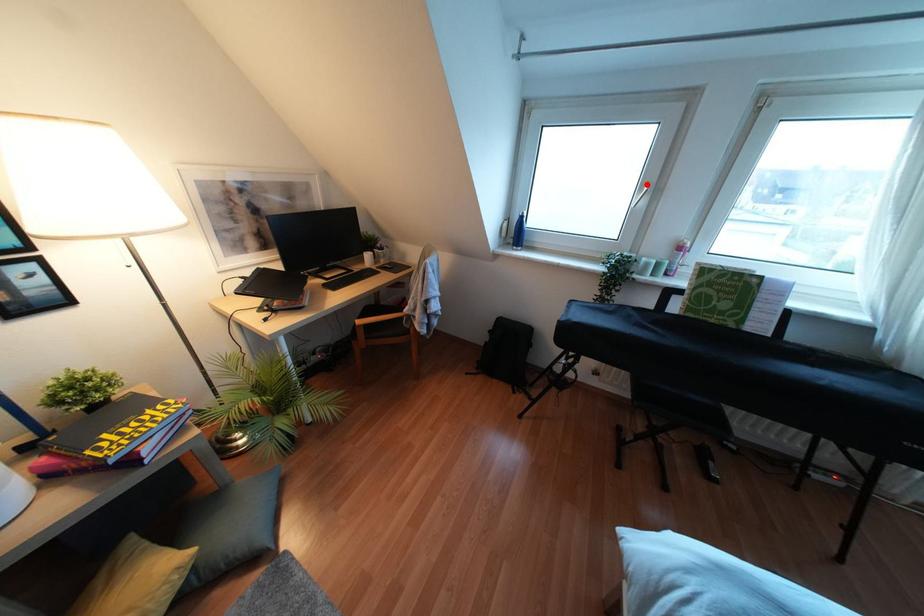
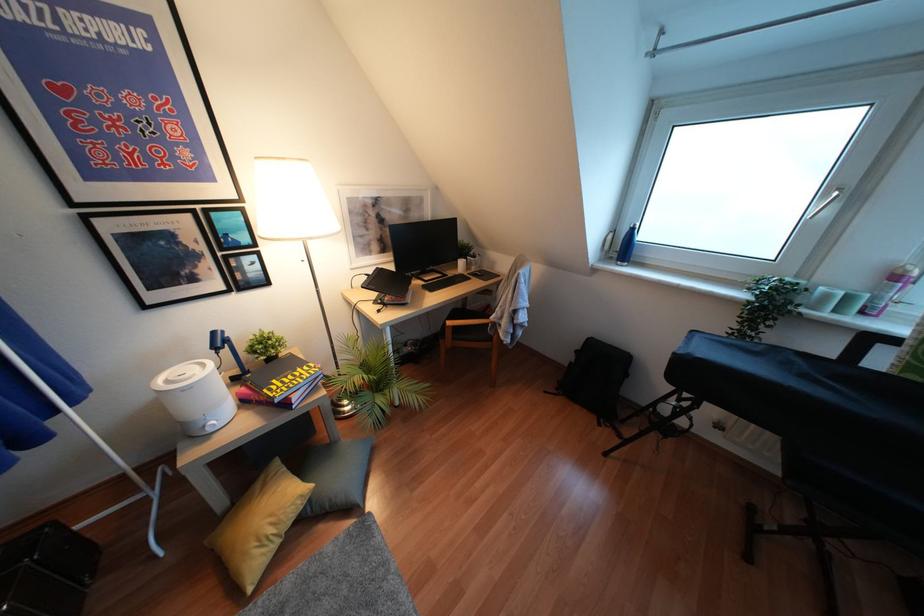
Question: A red point is marked in image1. In image2, is the corresponding 3D point closer to the camera or farther? Reply with the corresponding letter.

Choices:
 (A) The corresponding 3D point is closer.
 (B) The corresponding 3D point is farther.

Answer: (B)